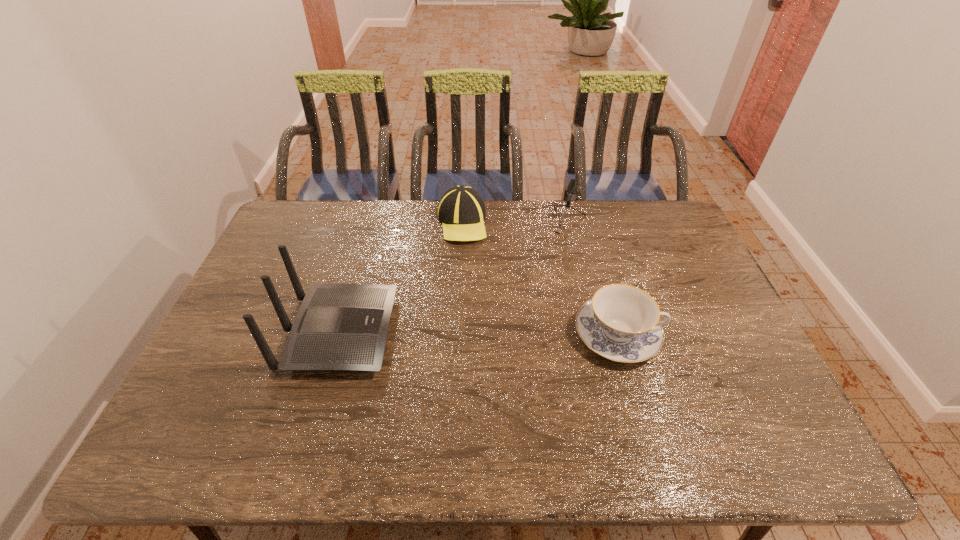
Locate an element on the screen. The image size is (960, 540). router is located at coordinates (339, 327).

This screenshot has width=960, height=540. I want to click on the tallest object, so click(339, 327).

Identify the location of chinaware. The width and height of the screenshot is (960, 540). (621, 322).

This screenshot has height=540, width=960. In order to click on microphone in this screenshot , I will do `click(572, 187)`.

Locate an element on the screen. baseball cap is located at coordinates (461, 210).

Identify the location of free space located on the front-facing side of the leftmost object. The height and width of the screenshot is (540, 960). (507, 333).

Locate an element on the screen. vacant space located with the handle on the side of the chinaware is located at coordinates (684, 335).

Find the location of a particular element. Image resolution: width=960 pixels, height=540 pixels. free space located on the stand of the microphone is located at coordinates click(502, 318).

Locate an element on the screen. free region located on the stand of the microphone is located at coordinates (504, 316).

The height and width of the screenshot is (540, 960). What are the coordinates of `vacant space situated on the stand of the microphone` in the screenshot? It's located at (540, 258).